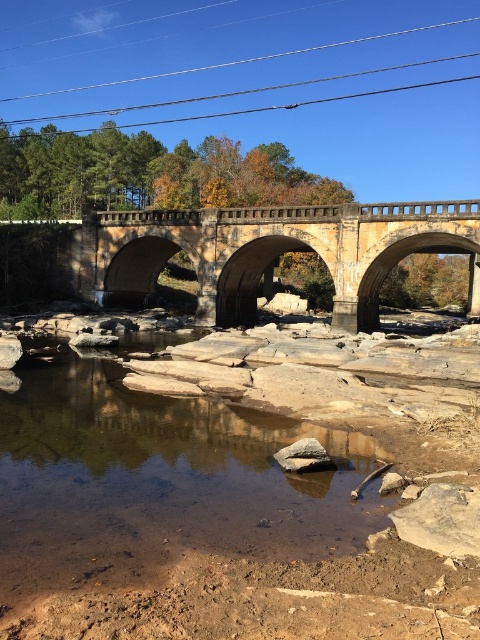
Between stone bridge at center and metallic wire at upper center, which one is positioned lower?

stone bridge at center is lower down.

Between stone bridge at center and metallic wire at upper center, which one has less height?

Standing shorter between the two is stone bridge at center.

Does point (478, 282) come in front of point (179, 72)?

Yes, point (478, 282) is closer to viewer.

Identify the location of stone bridge at center. This screenshot has height=640, width=480. (271, 252).

At what (x,y) coordinates should I click in order to perform the action: click on metallic wire at upper center. Please return your answer as a coordinate pair (x, y). The height and width of the screenshot is (640, 480). Looking at the image, I should click on (235, 61).

Looking at this image, between metallic wire at upper center and gray rough rock at center, which one is positioned higher?

Positioned higher is metallic wire at upper center.

I want to click on metallic wire at upper center, so click(x=235, y=61).

Is point (190, 257) closer to viewer compared to point (297, 470)?

No, (190, 257) is further to viewer.

Between point (425, 214) and point (286, 458), which one is positioned in front?

Point (286, 458) is in front.

Does point (262, 257) come closer to viewer compared to point (304, 458)?

No.

Where is `stone bridge at center`? stone bridge at center is located at coordinates (271, 252).